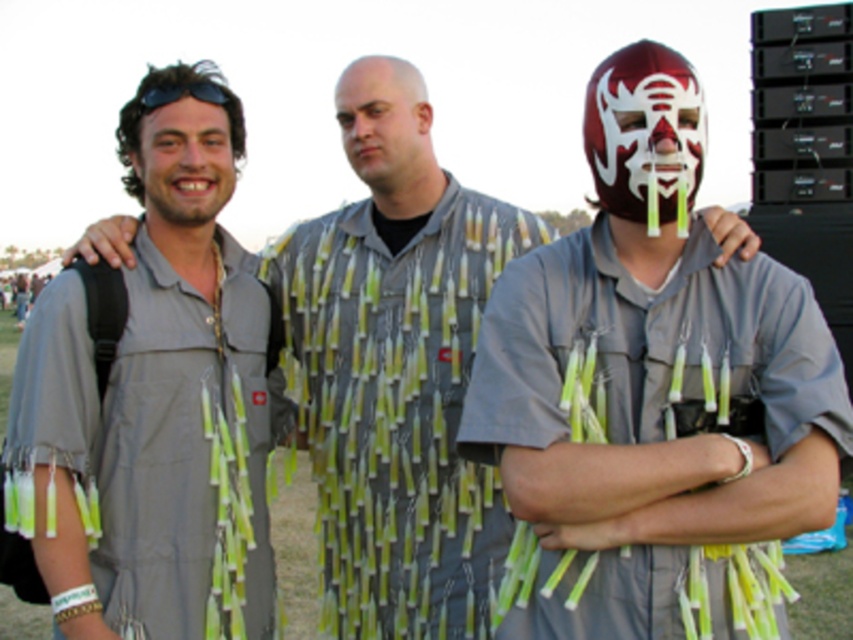
Question: Which of the following is the farthest from the observer?

Choices:
 (A) (177, 90)
 (B) (415, 116)
 (C) (196, 186)

Answer: (B)

Question: Is shiny plastic mask at center smaller than black matte sunglasses at upper left?

Choices:
 (A) yes
 (B) no

Answer: (B)

Question: Based on their relative distances, which object is nearer to the shiny plastic mask at center?

Choices:
 (A) matte gray shirt with tassels at center
 (B) matte gray shirt at left
 (C) black matte sunglasses at upper left

Answer: (A)

Question: Does matte gray shirt with tassels at center lie in front of gray fabric shirt at left?

Choices:
 (A) no
 (B) yes

Answer: (B)

Question: Estimate the real-world distances between objects in this image. Which object is farther from the black matte sunglasses at upper left?

Choices:
 (A) matte gray shirt at left
 (B) smooth bald head at center
 (C) matte gray shirt with tassels at center

Answer: (C)

Question: Does gray fabric shirt at left appear on the right side of matte gray shirt at left?

Choices:
 (A) yes
 (B) no

Answer: (A)